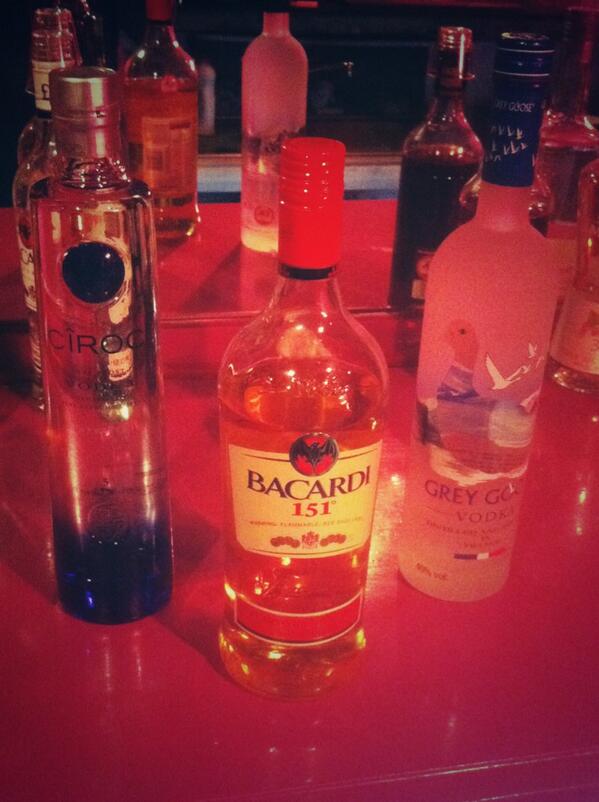
Image resolution: width=599 pixels, height=802 pixels. Identify the location of mirror. (376, 95).